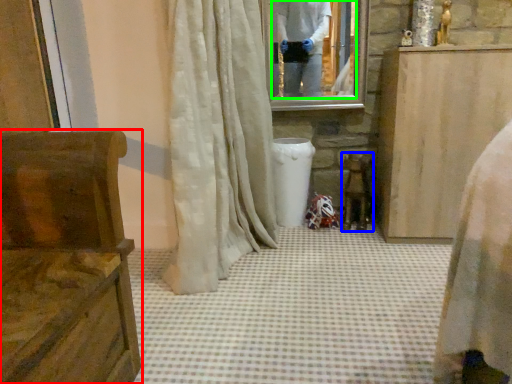
Question: Estimate the real-world distances between objects in this image. Which object is farther from furniture (highlighted by a red box), chair (highlighted by a blue box) or mirror (highlighted by a green box)?

Choices:
 (A) chair
 (B) mirror

Answer: (B)